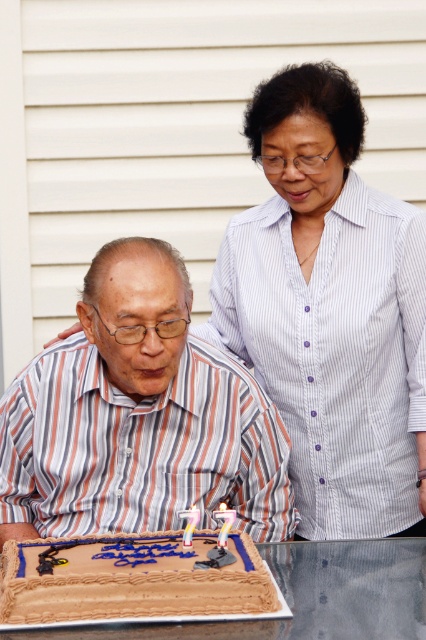
Question: Which of the following is the farthest from the observer?

Choices:
 (A) white striped shirt at upper right
 (B) translucent plastic candle at lower center
 (C) white plastic candle at center

Answer: (A)

Question: Which object is the closest to the translucent plastic candle at lower center?

Choices:
 (A) striped shirt at center
 (B) brown glossy table at lower center
 (C) white plastic candle at center

Answer: (C)

Question: Which object is the farthest from the brown glossy table at lower center?

Choices:
 (A) white plastic candle at center
 (B) translucent plastic candle at lower center
 (C) striped shirt at center
 (D) white striped shirt at upper right

Answer: (D)

Question: Is brown glossy table at lower center above translucent plastic candle at lower center?

Choices:
 (A) no
 (B) yes

Answer: (A)

Question: Is brown glossy table at lower center positioned behind white plastic candle at center?

Choices:
 (A) no
 (B) yes

Answer: (A)

Question: Does brown glossy table at lower center appear on the right side of translucent plastic candle at lower center?

Choices:
 (A) yes
 (B) no

Answer: (A)